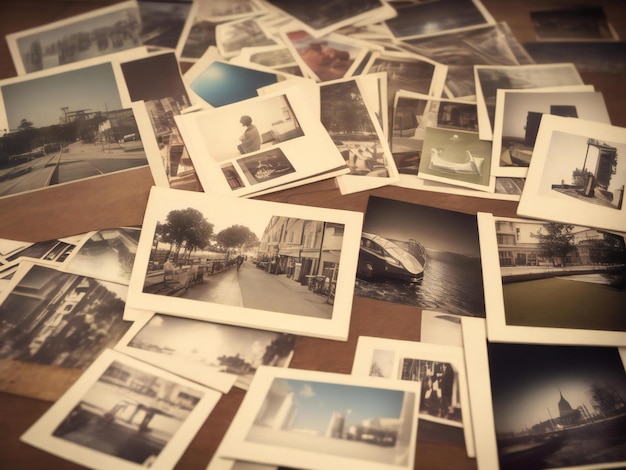
Identify the location of picture. This screenshot has width=626, height=470. (370, 389).